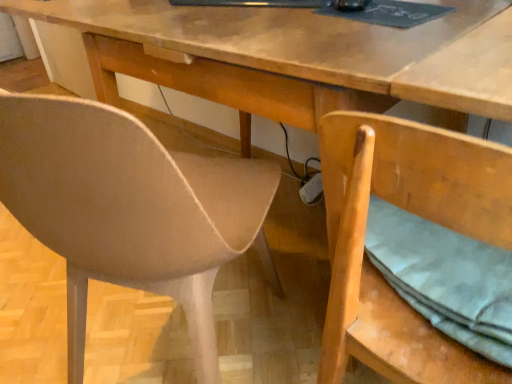
Where is `wooden chair at lower right, arranged as the second chair when viewed from the left`? wooden chair at lower right, arranged as the second chair when viewed from the left is located at coordinates point(416,214).

This screenshot has width=512, height=384. Describe the element at coordinates (416, 214) in the screenshot. I see `wooden chair at lower right, arranged as the second chair when viewed from the left` at that location.

Measure the distance between wooden chair at lower right, which is counted as the 1th chair, starting from the right, and camera.

wooden chair at lower right, which is counted as the 1th chair, starting from the right, is 14.49 inches away from camera.

What do you see at coordinates (130, 210) in the screenshot? This screenshot has height=384, width=512. I see `matte beige chair at left, arranged as the 1th chair when viewed from the left` at bounding box center [130, 210].

At what (x,y) coordinates should I click in order to perform the action: click on matte beige chair at left, which is counted as the 2th chair, starting from the right. Please return your answer as a coordinate pair (x, y). Image resolution: width=512 pixels, height=384 pixels. Looking at the image, I should click on (130, 210).

The height and width of the screenshot is (384, 512). I want to click on wooden chair at lower right, which is counted as the 1th chair, starting from the right, so click(x=416, y=214).

Considering the positions of objects matte beige chair at left, which is counted as the 2th chair, starting from the right, and wooden chair at lower right, arranged as the second chair when viewed from the left, in the image provided, who is more to the right, matte beige chair at left, which is counted as the 2th chair, starting from the right, or wooden chair at lower right, arranged as the second chair when viewed from the left,?

From the viewer's perspective, wooden chair at lower right, arranged as the second chair when viewed from the left, appears more on the right side.

Which object is closer to the camera, matte beige chair at left, arranged as the 1th chair when viewed from the left, or wooden chair at lower right, which is counted as the 1th chair, starting from the right?

matte beige chair at left, arranged as the 1th chair when viewed from the left, is in front.

Is point (225, 226) farther from camera compared to point (331, 177)?

Yes, it is.

From the image's perspective, which is above, matte beige chair at left, arranged as the 1th chair when viewed from the left, or wooden chair at lower right, arranged as the second chair when viewed from the left?

matte beige chair at left, arranged as the 1th chair when viewed from the left, appears higher in the image.

From a real-world perspective, between matte beige chair at left, arranged as the 1th chair when viewed from the left, and wooden chair at lower right, arranged as the second chair when viewed from the left, who is vertically higher?

wooden chair at lower right, arranged as the second chair when viewed from the left.

In terms of width, does matte beige chair at left, arranged as the 1th chair when viewed from the left, look wider or thinner when compared to wooden chair at lower right, which is counted as the 1th chair, starting from the right?

Clearly, matte beige chair at left, arranged as the 1th chair when viewed from the left, has more width compared to wooden chair at lower right, which is counted as the 1th chair, starting from the right.

Considering the relative sizes of matte beige chair at left, arranged as the 1th chair when viewed from the left, and wooden chair at lower right, arranged as the second chair when viewed from the left, in the image provided, is matte beige chair at left, arranged as the 1th chair when viewed from the left, shorter than wooden chair at lower right, arranged as the second chair when viewed from the left,?

No, matte beige chair at left, arranged as the 1th chair when viewed from the left, is not shorter than wooden chair at lower right, arranged as the second chair when viewed from the left.

Is matte beige chair at left, which is counted as the 2th chair, starting from the right, bigger than wooden chair at lower right, which is counted as the 1th chair, starting from the right?

Indeed, matte beige chair at left, which is counted as the 2th chair, starting from the right, has a larger size compared to wooden chair at lower right, which is counted as the 1th chair, starting from the right.

Is matte beige chair at left, which is counted as the 2th chair, starting from the right, located outside wooden chair at lower right, arranged as the second chair when viewed from the left?

matte beige chair at left, which is counted as the 2th chair, starting from the right, lies outside wooden chair at lower right, arranged as the second chair when viewed from the left,'s area.

Is matte beige chair at left, arranged as the 1th chair when viewed from the left, not close to wooden chair at lower right, which is counted as the 1th chair, starting from the right?

No, matte beige chair at left, arranged as the 1th chair when viewed from the left, is not far away from wooden chair at lower right, which is counted as the 1th chair, starting from the right.

Is matte beige chair at left, which is counted as the 2th chair, starting from the right, facing towards wooden chair at lower right, arranged as the second chair when viewed from the left?

No, matte beige chair at left, which is counted as the 2th chair, starting from the right, is not aimed at wooden chair at lower right, arranged as the second chair when viewed from the left.

Can you tell me how much matte beige chair at left, which is counted as the 2th chair, starting from the right, and wooden chair at lower right, arranged as the second chair when viewed from the left, differ in facing direction?

They differ by 15.5 degrees in their facing directions.

Could you measure the distance between matte beige chair at left, which is counted as the 2th chair, starting from the right, and wooden chair at lower right, which is counted as the 1th chair, starting from the right?

matte beige chair at left, which is counted as the 2th chair, starting from the right, is 12.10 inches away from wooden chair at lower right, which is counted as the 1th chair, starting from the right.

Locate an element on the screen. chair on the right of matte beige chair at left, which is counted as the 2th chair, starting from the right is located at coordinates (416, 214).

Between wooden chair at lower right, which is counted as the 1th chair, starting from the right, and matte beige chair at left, arranged as the 1th chair when viewed from the left, which one appears on the left side from the viewer's perspective?

matte beige chair at left, arranged as the 1th chair when viewed from the left, is more to the left.

Is wooden chair at lower right, which is counted as the 1th chair, starting from the right, in front of or behind matte beige chair at left, arranged as the 1th chair when viewed from the left, in the image?

Visually, wooden chair at lower right, which is counted as the 1th chair, starting from the right, is located behind matte beige chair at left, arranged as the 1th chair when viewed from the left.

Is point (481, 163) closer to viewer compared to point (124, 231)?

That is True.

From the image's perspective, is wooden chair at lower right, which is counted as the 1th chair, starting from the right, on matte beige chair at left, which is counted as the 2th chair, starting from the right?

No, from the image's perspective, wooden chair at lower right, which is counted as the 1th chair, starting from the right, is not above matte beige chair at left, which is counted as the 2th chair, starting from the right.

Based on the photo, from a real-world perspective, which is physically above, wooden chair at lower right, arranged as the second chair when viewed from the left, or matte beige chair at left, which is counted as the 2th chair, starting from the right?

wooden chair at lower right, arranged as the second chair when viewed from the left, is physically above.

Between wooden chair at lower right, which is counted as the 1th chair, starting from the right, and matte beige chair at left, which is counted as the 2th chair, starting from the right, which one has larger width?

matte beige chair at left, which is counted as the 2th chair, starting from the right.

Is wooden chair at lower right, arranged as the second chair when viewed from the left, taller or shorter than matte beige chair at left, arranged as the 1th chair when viewed from the left?

Clearly, wooden chair at lower right, arranged as the second chair when viewed from the left, is shorter compared to matte beige chair at left, arranged as the 1th chair when viewed from the left.

Which of these two, wooden chair at lower right, arranged as the second chair when viewed from the left, or matte beige chair at left, which is counted as the 2th chair, starting from the right, is bigger?

matte beige chair at left, which is counted as the 2th chair, starting from the right, is bigger.

Would you say wooden chair at lower right, which is counted as the 1th chair, starting from the right, contains matte beige chair at left, arranged as the 1th chair when viewed from the left?

No, wooden chair at lower right, which is counted as the 1th chair, starting from the right, does not contain matte beige chair at left, arranged as the 1th chair when viewed from the left.

Is wooden chair at lower right, arranged as the second chair when viewed from the left, facing towards matte beige chair at left, which is counted as the 2th chair, starting from the right?

No, wooden chair at lower right, arranged as the second chair when viewed from the left, is not oriented towards matte beige chair at left, which is counted as the 2th chair, starting from the right.

Measure the distance from wooden chair at lower right, arranged as the second chair when viewed from the left, to matte beige chair at left, which is counted as the 2th chair, starting from the right.

12.10 inches.

This screenshot has height=384, width=512. In order to click on chair on the right of matte beige chair at left, arranged as the 1th chair when viewed from the left in this screenshot , I will do `click(416, 214)`.

Where is `chair positioned vertically above the matte beige chair at left, arranged as the 1th chair when viewed from the left (from a real-world perspective)`? This screenshot has width=512, height=384. chair positioned vertically above the matte beige chair at left, arranged as the 1th chair when viewed from the left (from a real-world perspective) is located at coordinates [416, 214].

Locate an element on the screen. The height and width of the screenshot is (384, 512). chair beneath the wooden chair at lower right, which is counted as the 1th chair, starting from the right (from a real-world perspective) is located at coordinates (130, 210).